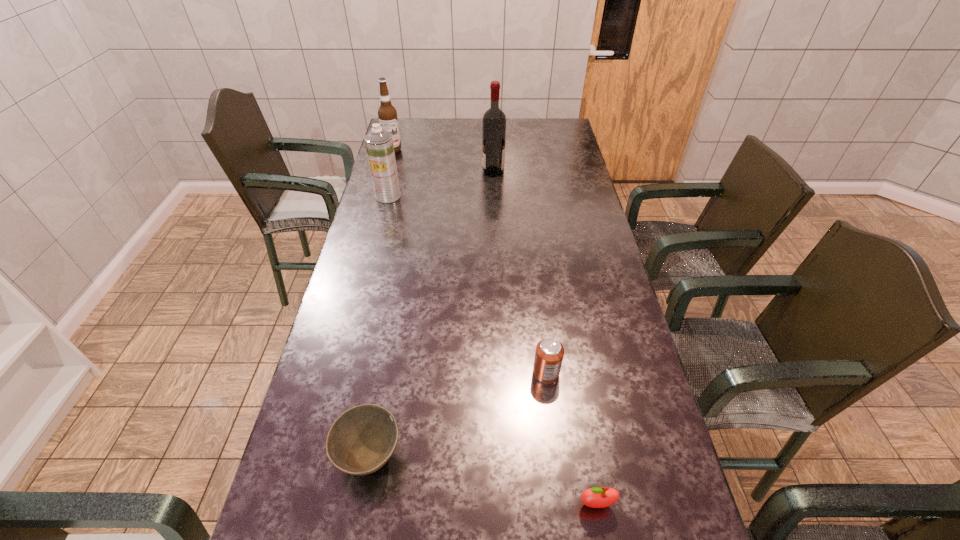
The image size is (960, 540). In order to click on vacant region that satisfies the following two spatial constraints: 1. on the back side of the can; 2. on the left side of the second nearest object in this screenshot , I will do [385, 373].

Find the location of a particular element. This screenshot has height=540, width=960. free space that satisfies the following two spatial constraints: 1. on the front and back of the nearer alcohol; 2. on the right side of the apple is located at coordinates (506, 504).